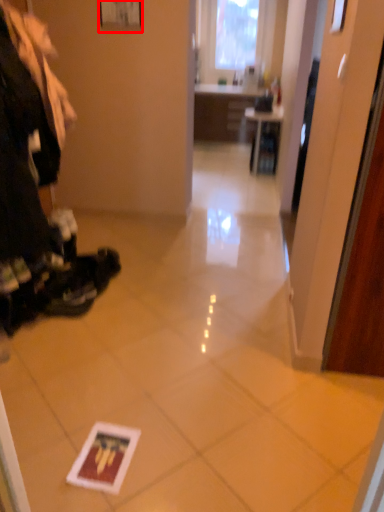
Question: From the image's perspective, where is picture frame (annotated by the red box) located relative to table?

Choices:
 (A) above
 (B) below

Answer: (A)